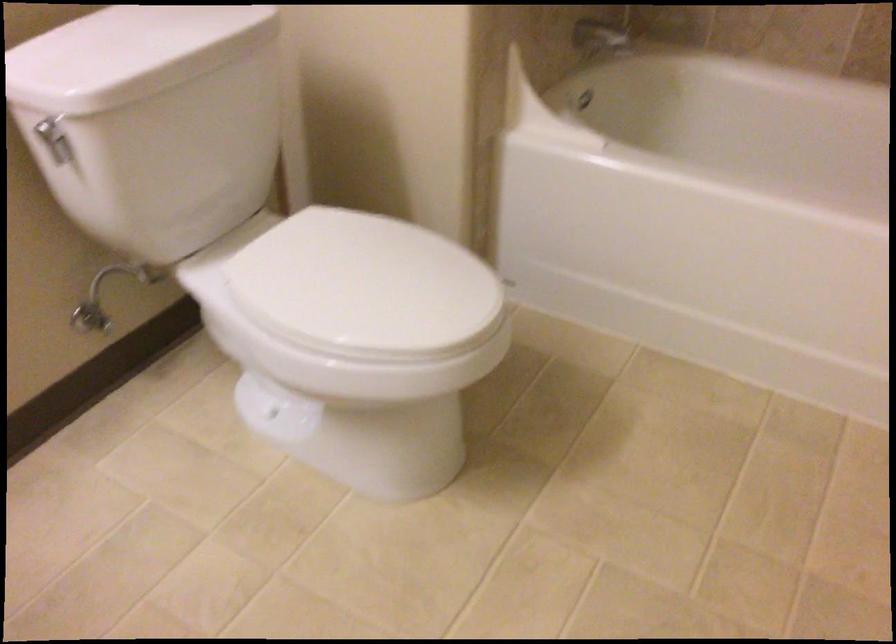
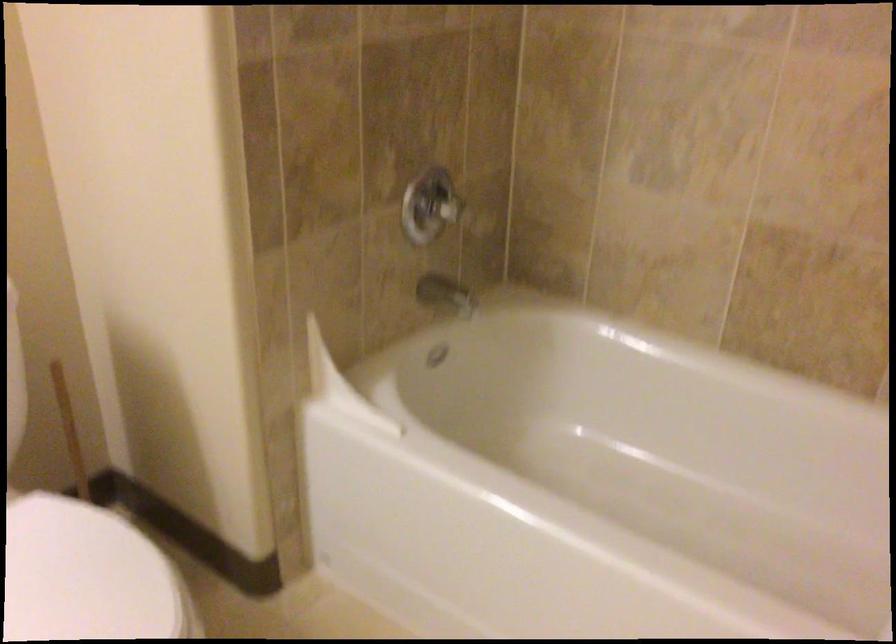
Where in the second image is the point corresponding to (279,178) from the first image?

(72, 438)